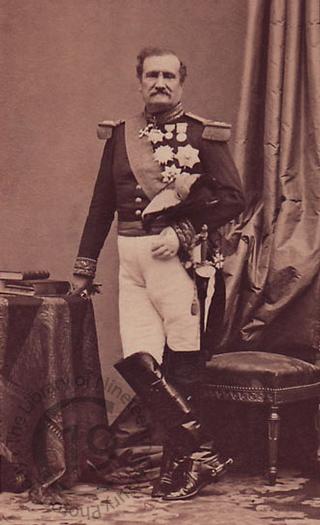
Identify the location of chair. (275, 364).